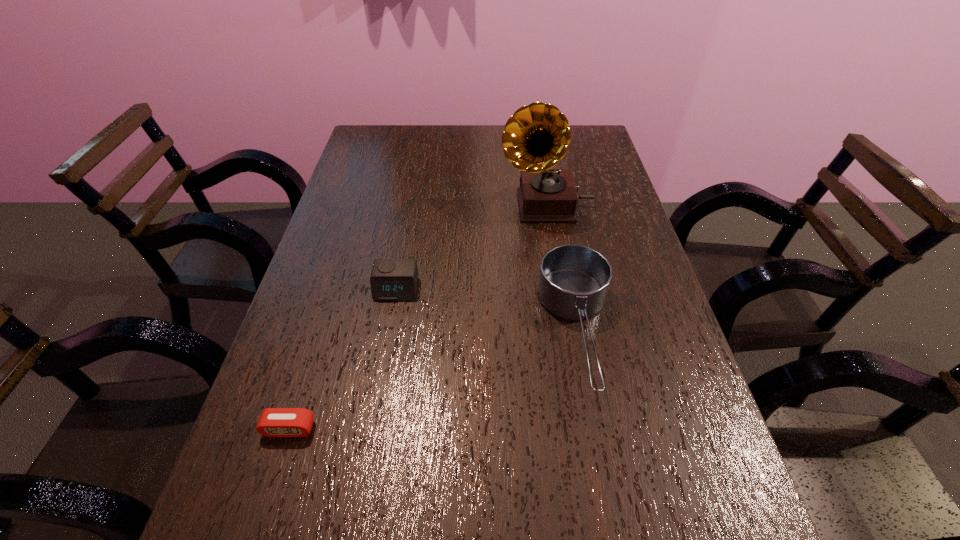
Where is `the farthest object`? This screenshot has width=960, height=540. the farthest object is located at coordinates (536, 137).

Where is `the tallest object`? This screenshot has width=960, height=540. the tallest object is located at coordinates (536, 137).

In order to click on the third shortest object in this screenshot , I will do `click(574, 280)`.

Where is `the third tallest object`? This screenshot has width=960, height=540. the third tallest object is located at coordinates (391, 279).

At what (x,y) coordinates should I click in order to perform the action: click on the taller alarm clock. Please return your answer as a coordinate pair (x, y). Image resolution: width=960 pixels, height=540 pixels. Looking at the image, I should click on [x=391, y=279].

Where is `the nearer alarm clock`? The height and width of the screenshot is (540, 960). the nearer alarm clock is located at coordinates (274, 422).

This screenshot has width=960, height=540. What are the coordinates of `the leftmost object` in the screenshot? It's located at (274, 422).

This screenshot has width=960, height=540. Identify the location of vacant area situated 0.330m from the horn of the tallest object. (383, 205).

Locate an element on the screen. This screenshot has height=540, width=960. free space located 0.070m from the horn of the tallest object is located at coordinates (474, 205).

At what (x,y) coordinates should I click in order to perform the action: click on blank space located 0.280m from the horn of the tallest object. Please return your answer as a coordinate pair (x, y). Looking at the image, I should click on (400, 205).